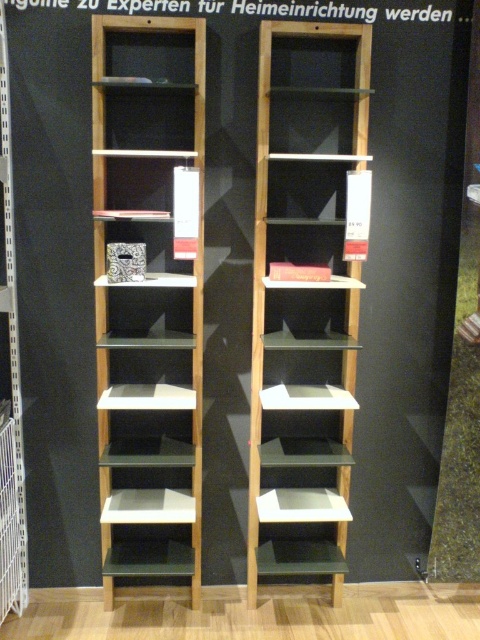
Question: Which of the following is the closest to the observer?

Choices:
 (A) light brown wood bookshelf at center
 (B) matte oak bookshelf at center
 (C) light brown wood bookshelf at left

Answer: (B)

Question: Which point is closer to the camera?

Choices:
 (A) light brown wood bookshelf at center
 (B) matte oak bookshelf at center
 (C) light brown wood bookshelf at left

Answer: (B)

Question: Can you confirm if light brown wood bookshelf at center is positioned below light brown wood bookshelf at left?

Choices:
 (A) no
 (B) yes

Answer: (B)

Question: Which point is closer to the camera taking this photo?

Choices:
 (A) (192, 323)
 (B) (1, 20)

Answer: (B)

Question: Does light brown wood bookshelf at center appear over light brown wood bookshelf at left?

Choices:
 (A) no
 (B) yes

Answer: (A)

Question: Does matte oak bookshelf at center have a lesser width compared to light brown wood bookshelf at left?

Choices:
 (A) yes
 (B) no

Answer: (B)